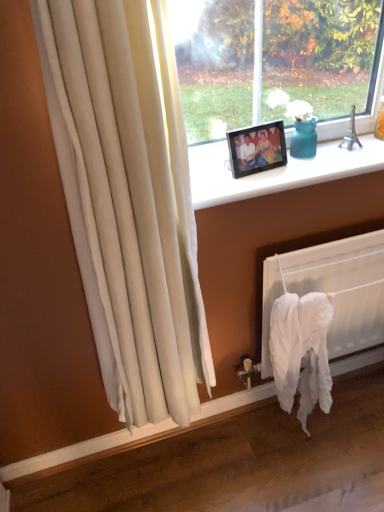
Question: Can you confirm if black plastic frame at upper center is bigger than white fabric at lower right?

Choices:
 (A) no
 (B) yes

Answer: (A)

Question: Does black plastic frame at upper center have a greater height compared to white fabric at lower right?

Choices:
 (A) no
 (B) yes

Answer: (A)

Question: Is black plastic frame at upper center located outside white fabric at lower right?

Choices:
 (A) yes
 (B) no

Answer: (A)

Question: Is black plastic frame at upper center to the left of white fabric at lower right from the viewer's perspective?

Choices:
 (A) yes
 (B) no

Answer: (A)

Question: Can you confirm if black plastic frame at upper center is shorter than white fabric at lower right?

Choices:
 (A) no
 (B) yes

Answer: (B)

Question: From the image's perspective, is black plastic frame at upper center located beneath white fabric at lower right?

Choices:
 (A) no
 (B) yes

Answer: (A)

Question: Is black plastic picture frame at upper center to the right of white fabric at lower right from the viewer's perspective?

Choices:
 (A) yes
 (B) no

Answer: (B)

Question: Is black plastic picture frame at upper center aimed at white fabric at lower right?

Choices:
 (A) no
 (B) yes

Answer: (A)

Question: From a real-world perspective, is black plastic picture frame at upper center located higher than white fabric at lower right?

Choices:
 (A) yes
 (B) no

Answer: (A)

Question: From a real-world perspective, is black plastic picture frame at upper center under white fabric at lower right?

Choices:
 (A) yes
 (B) no

Answer: (B)

Question: Does black plastic picture frame at upper center have a lesser width compared to white fabric at lower right?

Choices:
 (A) no
 (B) yes

Answer: (B)

Question: Is white fabric at lower right completely or partially inside black plastic picture frame at upper center?

Choices:
 (A) yes
 (B) no

Answer: (B)

Question: Does black plastic frame at upper center lie behind black plastic picture frame at upper center?

Choices:
 (A) yes
 (B) no

Answer: (B)